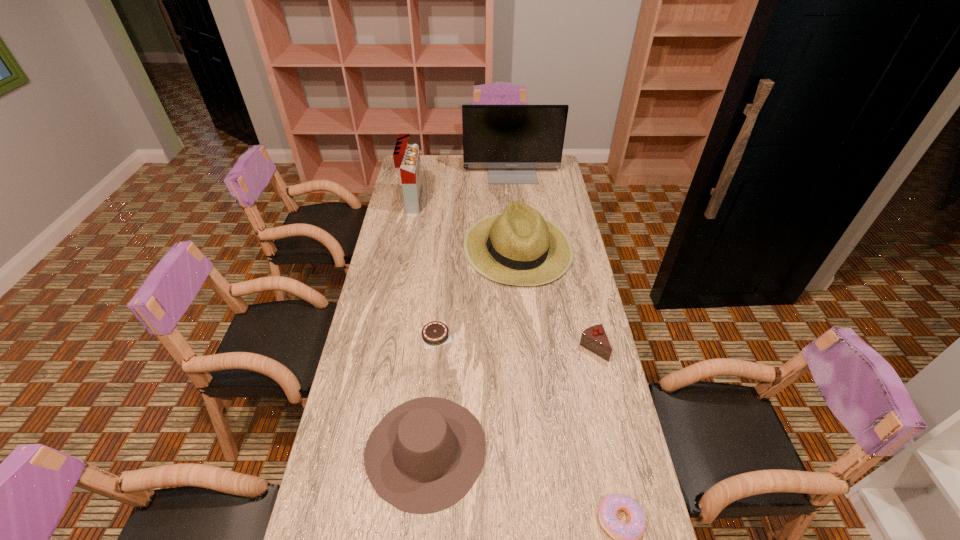
Identify the location of computer monitor. This screenshot has width=960, height=540. (511, 141).

You are a GUI agent. You are given a task and a screenshot of the screen. Output one action in this format:
    pyautogui.click(x=<x>, y=<y>)
    Task: Click on the sixth shortest object
    The image size is (960, 540).
    Given the screenshot: What is the action you would take?
    pyautogui.click(x=406, y=156)

Image resolution: width=960 pixels, height=540 pixels. I want to click on the third tallest object, so click(520, 247).

Locate an element on the screen. The height and width of the screenshot is (540, 960). cowboy hat is located at coordinates (424, 456).

Find the location of a particular element. This screenshot has height=540, width=960. the taller chocolate cake is located at coordinates (594, 338).

At what (x,y) coordinates should I click in order to perform the action: click on the fifth tallest object. Please return your answer as a coordinate pair (x, y). Image resolution: width=960 pixels, height=540 pixels. Looking at the image, I should click on 594,338.

This screenshot has height=540, width=960. In order to click on the shorter chocolate cake in this screenshot , I will do pyautogui.click(x=435, y=333).

Locate an element on the screen. The height and width of the screenshot is (540, 960). the shortest object is located at coordinates (435, 333).

Locate an element on the screen. This screenshot has height=540, width=960. vacant position located on the screen of the computer monitor is located at coordinates (516, 218).

The height and width of the screenshot is (540, 960). I want to click on free point located 0.130m with the lid open on the second tallest object, so click(x=449, y=202).